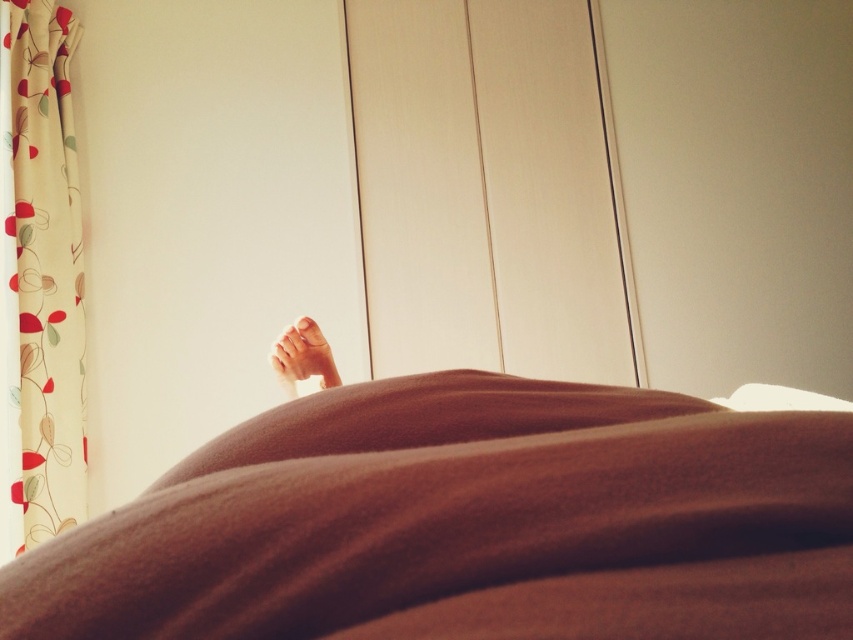
Consider the image. You are a photographer setting up a shoot in this room. You need to decide whether the floral fabric curtain at left will block the view of the smooth skin foot at center when viewed from the front. Based on their positions, can you confirm if the curtain is covering the foot?

The floral fabric curtain at left is positioned over the smooth skin foot at center, so yes, the curtain is covering the foot when viewed from the front.

You are a photographer setting up a shot of the scene. You need to place a small prop in front of both point (x=270, y=588) and point (x=315, y=336). Where should you place the prop so it is in front of both points?

The prop should be placed in front of point (x=270, y=588) because it is in front of point (x=315, y=336).